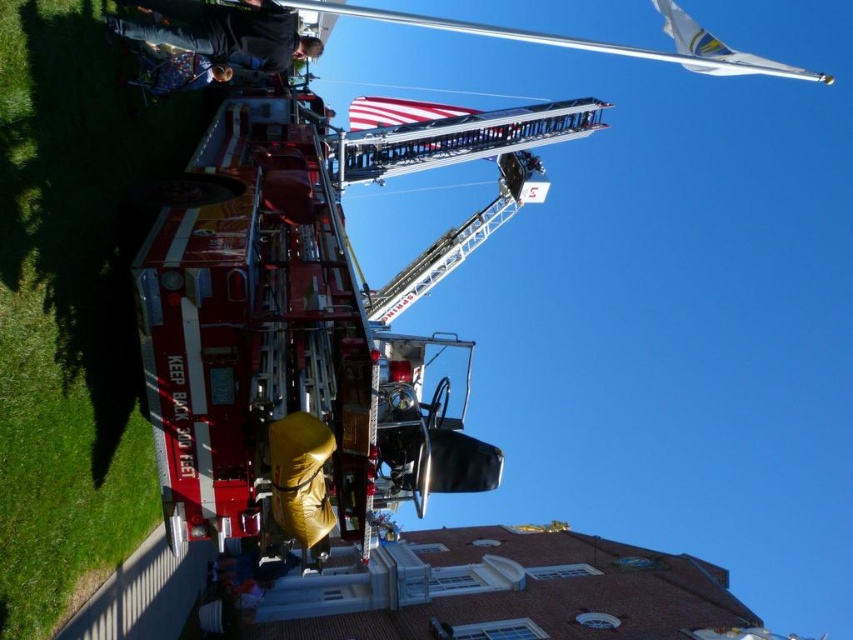
Does red metallic fire truck at center have a larger size compared to dark gray fabric jacket at upper left?

Yes.

Based on the photo, who is more forward, (339, 504) or (215, 24)?

Positioned in front is point (339, 504).

The image size is (853, 640). I want to click on red metallic fire truck at center, so click(x=309, y=323).

Can you confirm if red metallic fire truck at center is positioned below american flag at center?

Correct, red metallic fire truck at center is located below american flag at center.

The width and height of the screenshot is (853, 640). Describe the element at coordinates (309, 323) in the screenshot. I see `red metallic fire truck at center` at that location.

The height and width of the screenshot is (640, 853). Find the location of `red metallic fire truck at center`. red metallic fire truck at center is located at coordinates (309, 323).

Does point (280, 26) lie behind point (143, 76)?

Yes, point (280, 26) is behind point (143, 76).

Where is `dark gray fabric jacket at upper left`? The width and height of the screenshot is (853, 640). dark gray fabric jacket at upper left is located at coordinates (222, 29).

Between point (227, 48) and point (170, 84), which one is positioned behind?

The point (170, 84) is behind.

Identify the location of dark gray fabric jacket at upper left. This screenshot has height=640, width=853. pos(222,29).